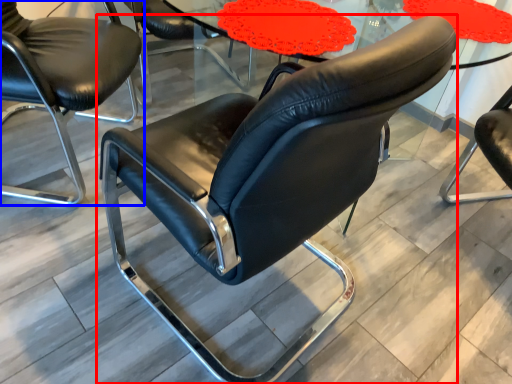
Question: Which object appears closest to the camera in this image, chair (highlighted by a red box) or chair (highlighted by a blue box)?

Choices:
 (A) chair
 (B) chair

Answer: (A)